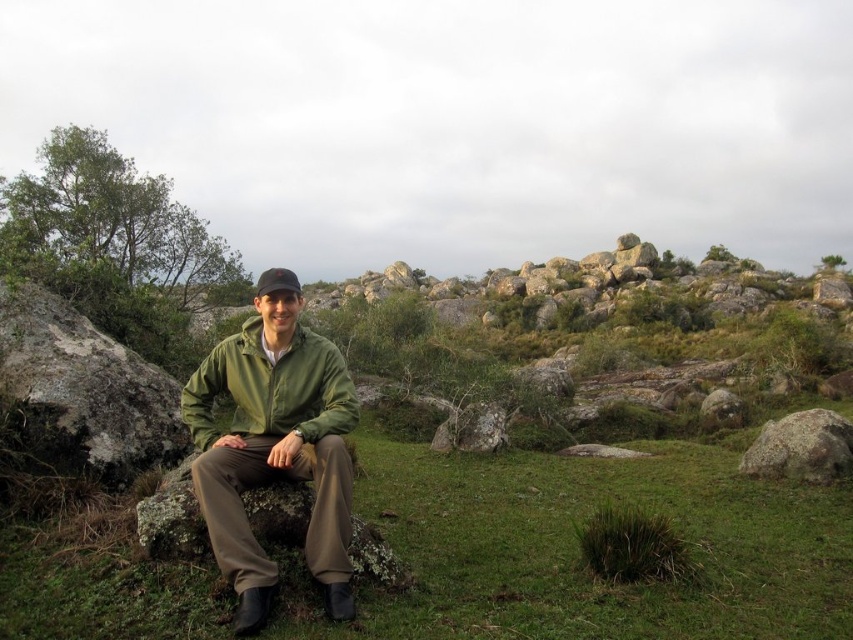
Question: Estimate the real-world distances between objects in this image. Which object is farther from the black fabric cap at center?

Choices:
 (A) rusty rock at right
 (B) smooth gray rock at center

Answer: (A)

Question: Does smooth gray rock at center-right come behind black fabric cap at center?

Choices:
 (A) yes
 (B) no

Answer: (A)

Question: Is green grass at center positioned in front of black fabric cap at center?

Choices:
 (A) no
 (B) yes

Answer: (B)

Question: Considering the real-world distances, which object is farthest from the green grass at center?

Choices:
 (A) rusty rock at right
 (B) smooth gray rock at center-right

Answer: (B)

Question: Based on their relative distances, which object is nearer to the green matte jacket at center?

Choices:
 (A) smooth gray rock at center-right
 (B) black fabric cap at center

Answer: (B)

Question: Where is rusty rock at right located in relation to black fabric cap at center in the image?

Choices:
 (A) below
 (B) above

Answer: (A)